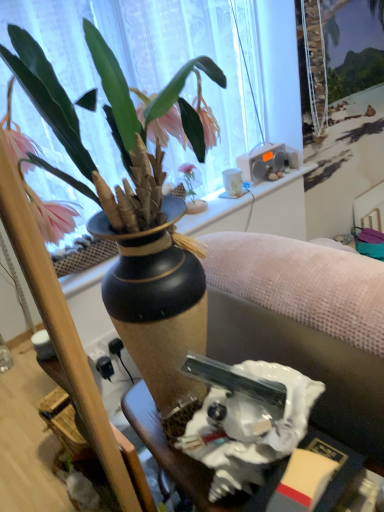
Question: Is matte black vase at upper center oriented away from pink matte vase at upper center?

Choices:
 (A) no
 (B) yes

Answer: (A)

Question: From the image's perspective, would you say matte black vase at upper center is shown under pink matte vase at upper center?

Choices:
 (A) yes
 (B) no

Answer: (B)

Question: Is matte black vase at upper center thinner than pink matte vase at upper center?

Choices:
 (A) no
 (B) yes

Answer: (B)

Question: From a real-world perspective, is matte black vase at upper center below pink matte vase at upper center?

Choices:
 (A) no
 (B) yes

Answer: (A)

Question: Considering the relative sizes of matte black vase at upper center and pink matte vase at upper center in the image provided, is matte black vase at upper center wider than pink matte vase at upper center?

Choices:
 (A) no
 (B) yes

Answer: (A)

Question: Is point (203, 501) closer or farther from the camera than point (201, 209)?

Choices:
 (A) closer
 (B) farther

Answer: (A)

Question: From the image's perspective, relative to pink matte vase at upper center, is white glossy statue at lower center above or below?

Choices:
 (A) above
 (B) below

Answer: (B)

Question: In the image, is white glossy statue at lower center positioned in front of or behind pink matte vase at upper center?

Choices:
 (A) front
 (B) behind

Answer: (A)

Question: From their relative heights in the image, would you say white glossy statue at lower center is taller or shorter than pink matte vase at upper center?

Choices:
 (A) short
 (B) tall

Answer: (A)

Question: Would you say matte gray couch at center is to the left or to the right of pink matte vase at upper center in the picture?

Choices:
 (A) right
 (B) left

Answer: (A)

Question: Considering the positions of matte gray couch at center and pink matte vase at upper center in the image, is matte gray couch at center wider or thinner than pink matte vase at upper center?

Choices:
 (A) wide
 (B) thin

Answer: (A)

Question: From the image's perspective, relative to pink matte vase at upper center, is matte gray couch at center above or below?

Choices:
 (A) above
 (B) below

Answer: (B)

Question: Is matte gray couch at center in front of or behind pink matte vase at upper center in the image?

Choices:
 (A) front
 (B) behind

Answer: (A)

Question: In terms of size, does matte black vase at upper center appear bigger or smaller than white glossy statue at lower center?

Choices:
 (A) big
 (B) small

Answer: (A)

Question: Relative to white glossy statue at lower center, is matte black vase at upper center in front or behind?

Choices:
 (A) behind
 (B) front

Answer: (A)